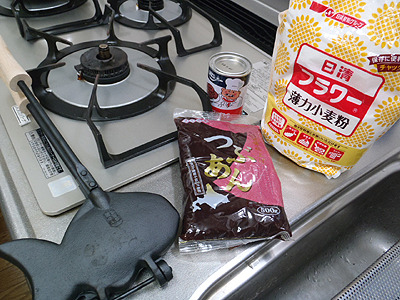
Where is `stove burner`? stove burner is located at coordinates (108, 59), (148, 1).